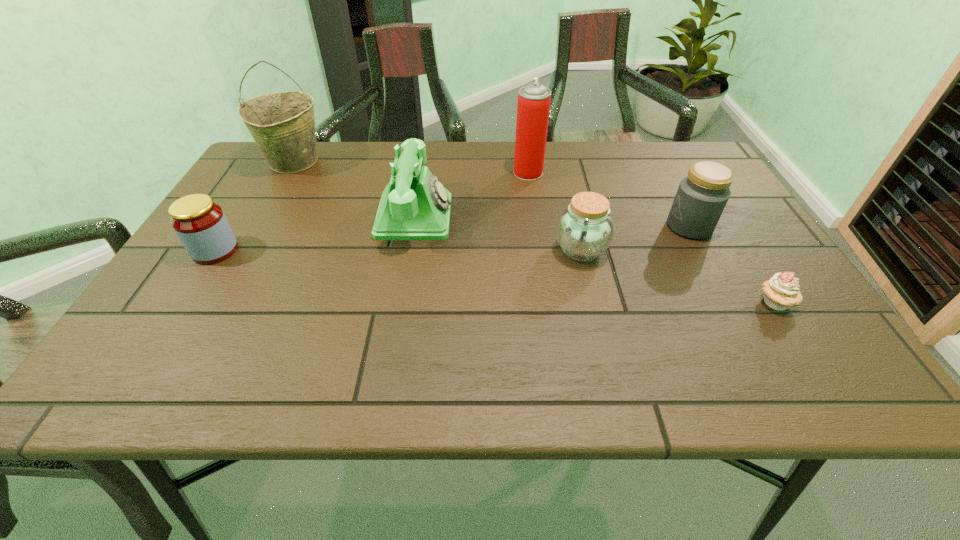
Where is `free spot between the rightmost jar and the aerosol can`? The image size is (960, 540). free spot between the rightmost jar and the aerosol can is located at coordinates (609, 199).

Where is `unoccupied position between the aerosol can and the second jar from right to left`? The image size is (960, 540). unoccupied position between the aerosol can and the second jar from right to left is located at coordinates (554, 212).

The image size is (960, 540). What are the coordinates of `vacant point located between the aerosol can and the second jar from left to right` in the screenshot? It's located at (554, 212).

Where is `vacant area between the cupcake and the second object from right to left`? The height and width of the screenshot is (540, 960). vacant area between the cupcake and the second object from right to left is located at coordinates (732, 265).

Identify the location of vacant space that is in between the second object from right to left and the telephone. (552, 221).

Locate an element on the screen. The image size is (960, 540). free space that is in between the fifth object from right to left and the wine bucket is located at coordinates (354, 190).

Find the location of `free spot between the rightmost jar and the aerosol can`. free spot between the rightmost jar and the aerosol can is located at coordinates tap(609, 199).

Select which object appears as the fifth closest to the telephone. Please provide its 2D coordinates. Your answer should be formatted as a tuple, i.e. [(x, y)], where the tuple contains the x and y coordinates of a point satisfying the conditions above.

[(701, 197)]

Identify which object is the sixth closest to the leftmost jar. Please provide its 2D coordinates. Your answer should be formatted as a tuple, i.e. [(x, y)], where the tuple contains the x and y coordinates of a point satisfying the conditions above.

[(780, 292)]

Identify which jar is the closest to the rightmost jar. Please provide its 2D coordinates. Your answer should be formatted as a tuple, i.e. [(x, y)], where the tuple contains the x and y coordinates of a point satisfying the conditions above.

[(585, 229)]